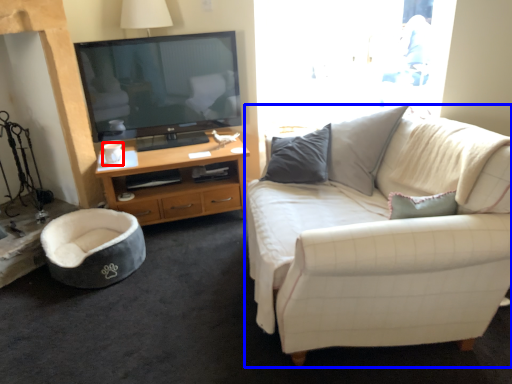
Question: Which object appears closest to the camera in this image, coffee cup (highlighted by a red box) or studio couch (highlighted by a blue box)?

Choices:
 (A) coffee cup
 (B) studio couch

Answer: (B)